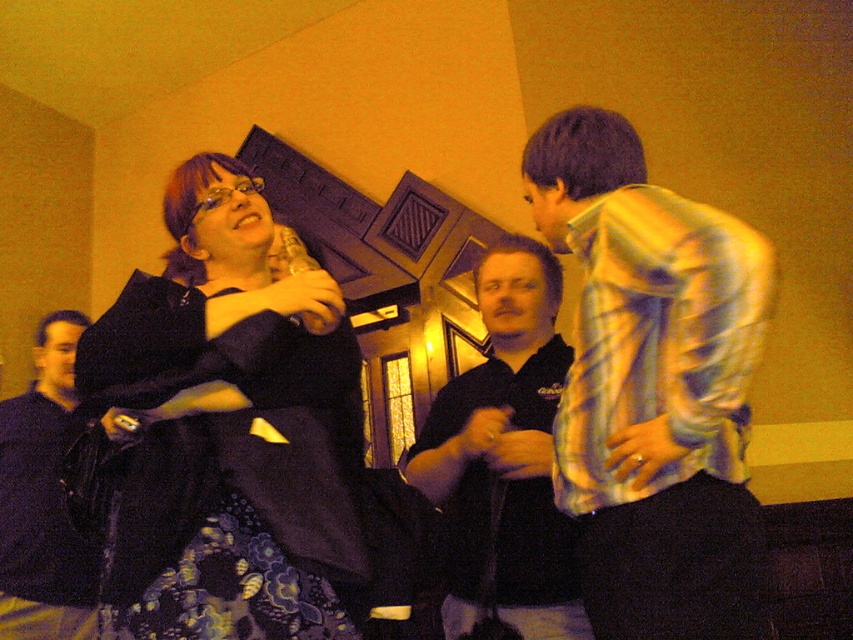
Question: Which of the following is the farthest from the observer?

Choices:
 (A) (70, 364)
 (B) (271, 589)
 (C) (570, 236)

Answer: (A)

Question: Does matte black dress at center lie behind dark blue shirt at left?

Choices:
 (A) yes
 (B) no

Answer: (B)

Question: Does matte black dress at center appear on the right side of dark blue shirt at left?

Choices:
 (A) yes
 (B) no

Answer: (A)

Question: Considering the real-world distances, which object is farthest from the dark blue shirt at left?

Choices:
 (A) black shirt at center
 (B) light blue satin shirt at right

Answer: (B)

Question: Which point is farther to the camera?

Choices:
 (A) black shirt at center
 (B) matte black dress at center
 (C) light blue satin shirt at right
 (D) dark blue shirt at left

Answer: (D)

Question: Can you confirm if matte black dress at center is positioned below light blue satin shirt at right?

Choices:
 (A) no
 (B) yes

Answer: (B)